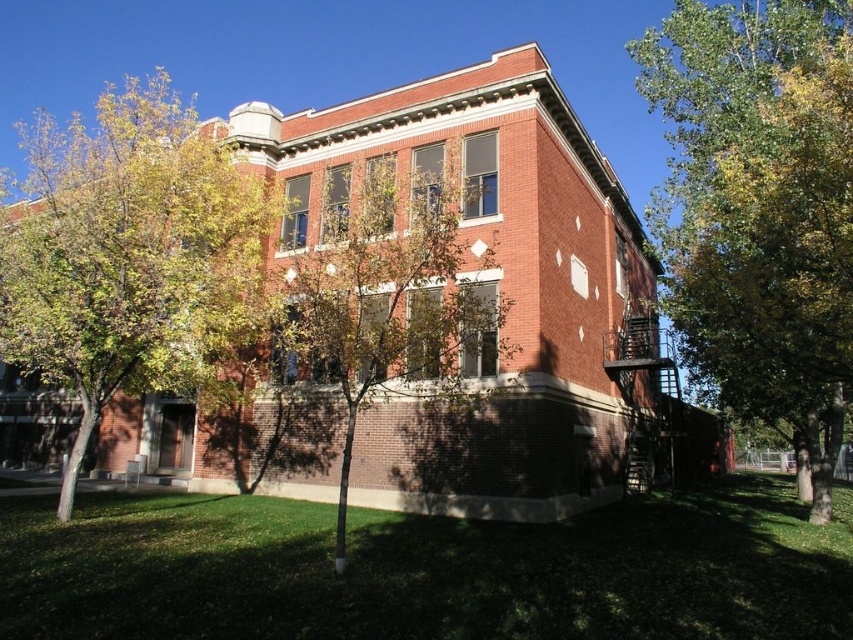
You are a gardener who needs to water two trees in the scene. The green leafy tree at right and the green leafy tree at lower left. If your watering can holds enough water to cover 20 meters between two points, can you water both trees without refilling?

The distance between the green leafy tree at right and the green leafy tree at lower left is 18.85 meters. Since your watering can can cover 20 meters, you have enough water to water both trees without refilling.

You are standing in front of the building and want to walk towards the green leafy tree at right. Which direction should you turn to avoid the green leafy tree at center?

To reach the green leafy tree at right while avoiding the green leafy tree at center, turn to your right since the green leafy tree at right is positioned to the right of the green leafy tree at center.